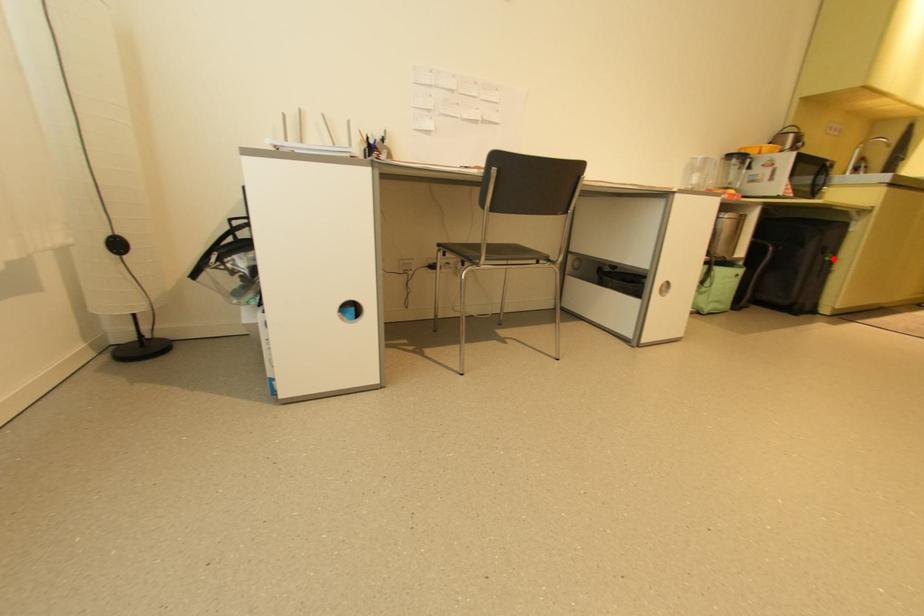
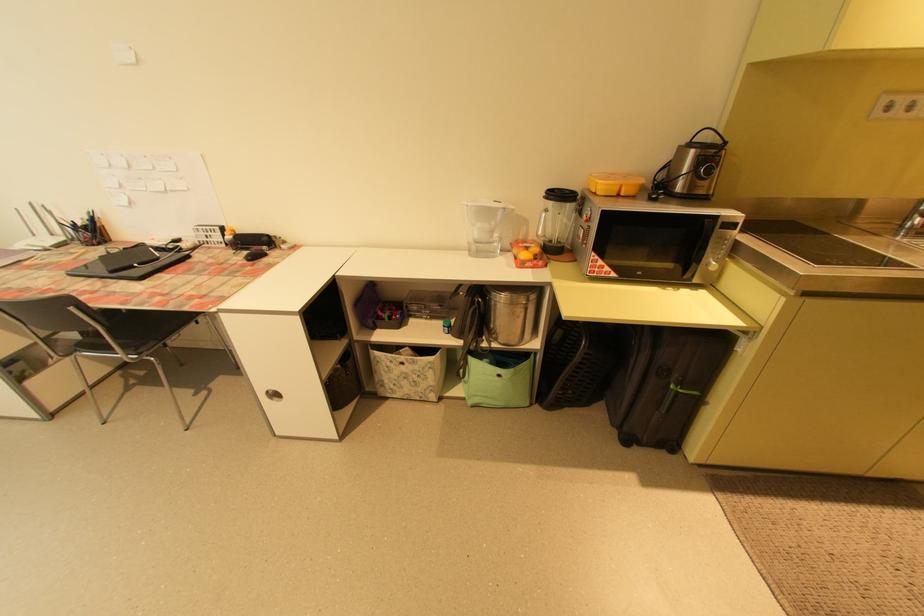
In the second image, find the point that corresponds to the highlighted location in the first image.

(678, 387)